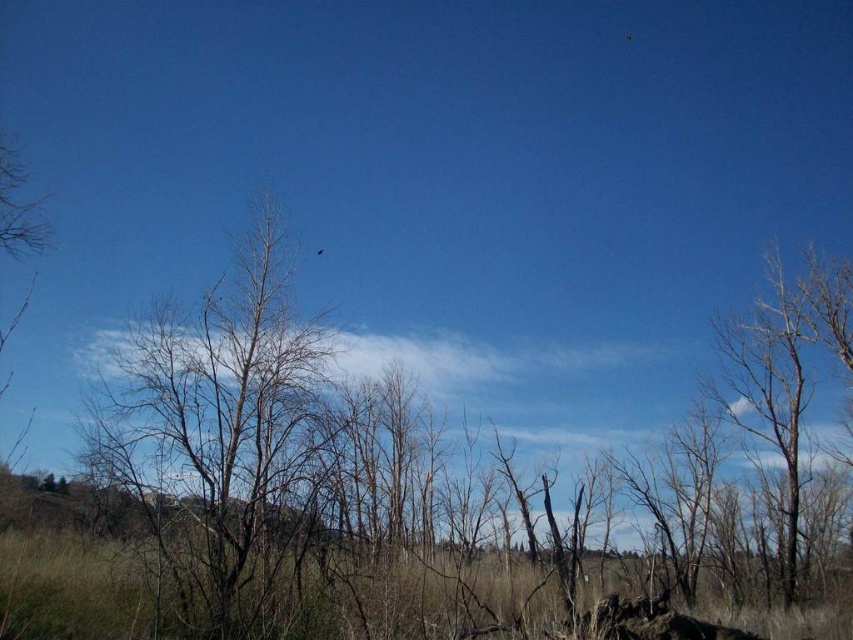
You are an ornithologist observing the black glossy bird at upper center and the brown bare tree at center. Which object is higher in the image?

The black glossy bird at upper center is higher in the image because it is positioned above the brown bare tree at center.

You are a painter standing in the field of dry grass and leafless trees. You want to paint the black glossy bird at upper center first. Which direction should you turn to face the brown bare tree at center?

The brown bare tree at center is to the right of the black glossy bird at upper center, so you should turn to your right to face the brown bare tree at center.